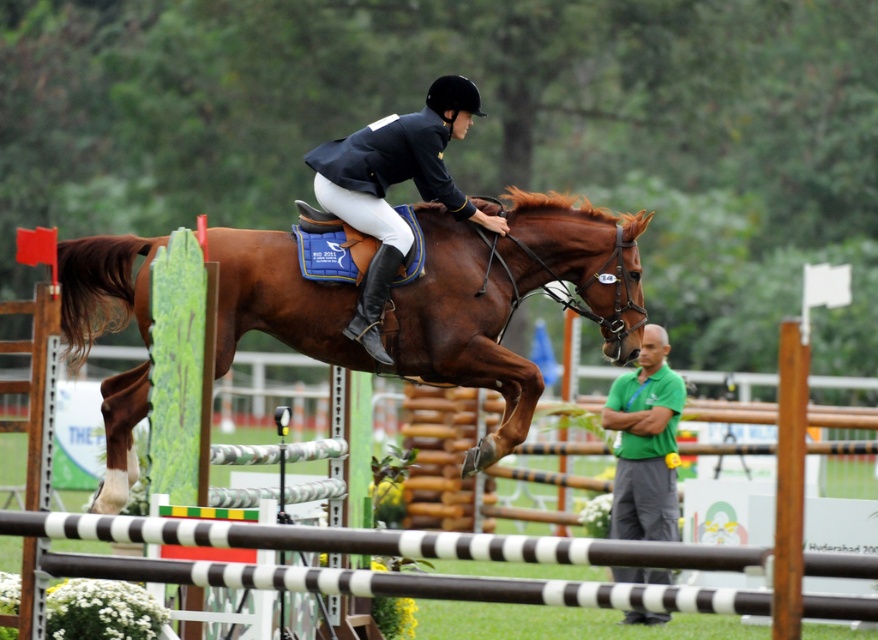
You are a photographer at the equestrian show. You need to capture a photo where both the shiny navy blue jacket at center and the green fabric shirt at lower right are clearly visible. Based on their positions, will the jacket block the view of the shirt in the photo?

The shiny navy blue jacket at center is located above the green fabric shirt at lower right, so it will not block the view of the shirt as they are positioned in different vertical areas.

You are a judge at the equestrian show. You need to determine if the rider cleared the jump properly. The jump has two points marked as point A at coordinates point A is point [88,316] and point B at coordinates point B is point [634,573]. According to the rules, the horse must clear the highest point of the jump. Which point is the highest point of the jump?

Point B at coordinates point [634,573] is the highest point of the jump because it is positioned behind point A at [88,316], and in show jumping, the highest point is typically located at the back of the obstacle.

You are a course designer planning the next equestrian show jumping event. You need to ensure there is enough space between the brown glossy horse at center and the green fabric shirt at lower right for the horse to safely maneuver. Based on the image, can you determine if the current distance allows for safe passage?

The brown glossy horse at center might be wider than green fabric shirt at lower right, so the distance between them may not be sufficient for safe passage. Adjust the positioning to ensure adequate space.